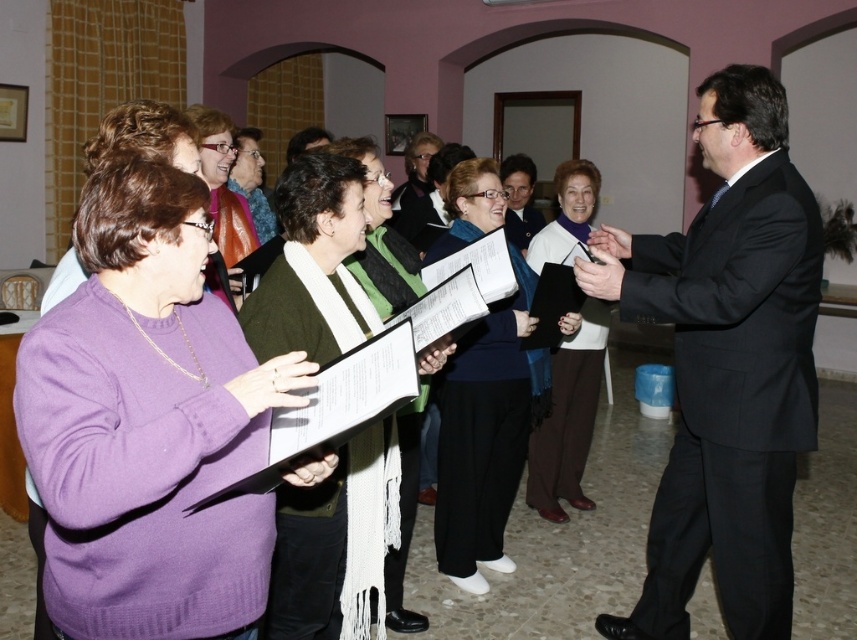
You are organizing a photo shoot and need to ensure that all purple sweaters in the image are visible. Given that the purple knit sweater at center and the matte purple sweater at upper left are both present, which one might require more attention to ensure it doesn not get lost in the composition?

The purple knit sweater at center might require more attention because it occupies less space and could be less noticeable compared to the matte purple sweater at upper left, which is larger in size.